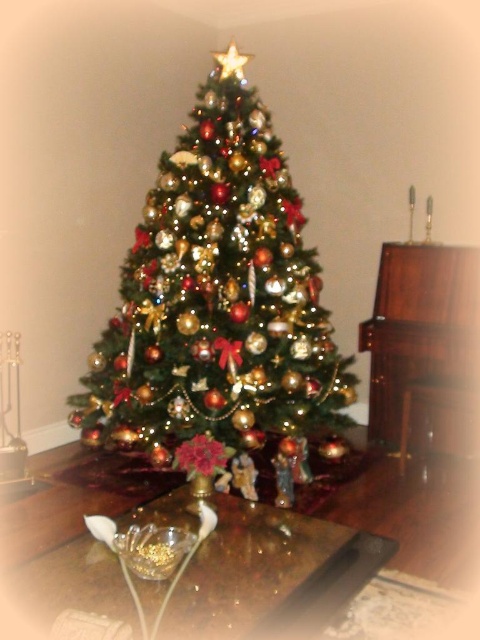
Question: Observing the image, what is the correct spatial positioning of shiny gold ornaments at center in reference to transparent glass bowl at center?

Choices:
 (A) right
 (B) left

Answer: (B)

Question: Is shiny gold ornaments at center closer to camera compared to transparent glass bowl at center?

Choices:
 (A) no
 (B) yes

Answer: (A)

Question: Which object appears closest to the camera in this image?

Choices:
 (A) transparent glass bowl at center
 (B) shiny gold ornaments at center

Answer: (A)

Question: Which point is closer to the camera?

Choices:
 (A) (264, 627)
 (B) (261, 268)

Answer: (A)

Question: Does shiny gold ornaments at center have a greater width compared to transparent glass bowl at center?

Choices:
 (A) yes
 (B) no

Answer: (A)